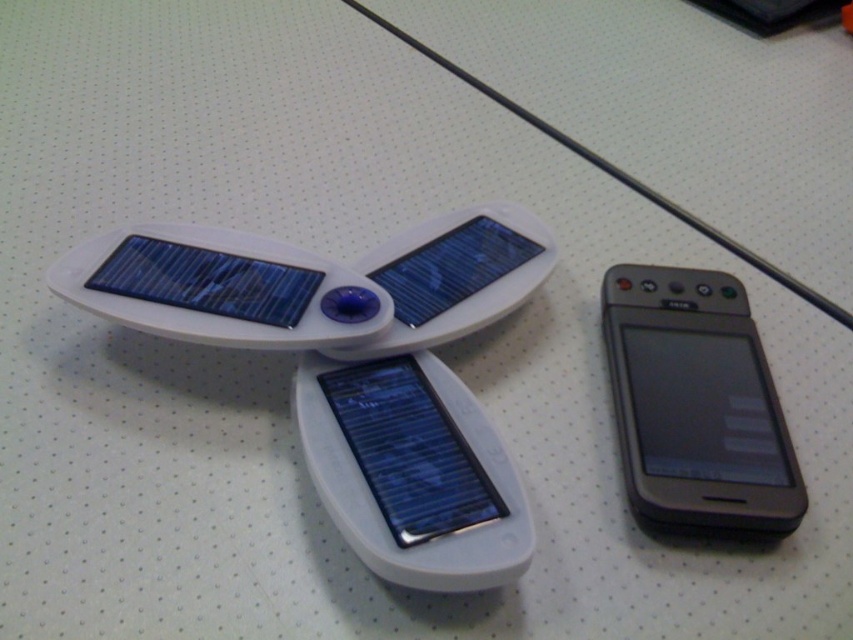
You are setting up a solar charging station and have two smartphones to charge. You need to place both phones on the solar device. The black matte smartphone at right requires more power than the slate gray metallic smartphone at center. Which phone should you place closer to the solar panels to ensure it gets enough power?

The black matte smartphone at right requires more power and has a larger size compared to the slate gray metallic smartphone at center. Since it needs more power, place it closer to the solar panels to ensure sufficient charging.

You are standing 5 feet away from the black matte smartphone at right. Can you reach it without moving your feet?

The black matte smartphone at right is 3.76 feet away from the camera. Since you are standing 5 feet away from it, you cannot reach it without moving your feet.

You are setting up a charging station for two smartphones. You have a black matte smartphone at right and a slate gray metallic smartphone at center. According to the scene, which smartphone is positioned higher?

The black matte smartphone at right is located above the slate gray metallic smartphone at center, so it is positioned higher.